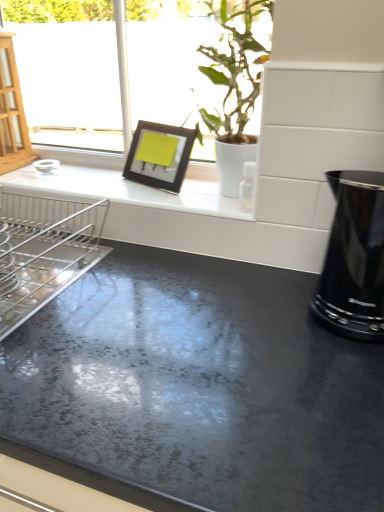
In order to face black matte picture frame at upper center, should I rotate leftwards or rightwards?

Rotate left and turn 4.777 degrees.

In order to face black glossy kettle at right, should I rotate leftwards or rightwards?

To align with it, rotate right about 20.689°.

Measure the distance between point (11, 252) and camera.

Point (11, 252) and camera are 33.43 inches apart.

What do you see at coordinates (124, 190) in the screenshot? I see `white glossy countertop at upper center` at bounding box center [124, 190].

The width and height of the screenshot is (384, 512). What are the coordinates of `black matte picture frame at upper center` in the screenshot? It's located at (159, 155).

Does green leafy plant at upper center have a larger size compared to black glossy kettle at right?

Indeed, green leafy plant at upper center has a larger size compared to black glossy kettle at right.

Would you say green leafy plant at upper center is a long distance from black glossy kettle at right?

That's not correct — green leafy plant at upper center is a little close to black glossy kettle at right.

How different are the orientations of green leafy plant at upper center and black glossy kettle at right in degrees?

green leafy plant at upper center and black glossy kettle at right are facing 6.84 degrees away from each other.

Would you say green leafy plant at upper center is inside or outside black glossy kettle at right?

green leafy plant at upper center cannot be found inside black glossy kettle at right.

Are black matte picture frame at upper center and black glossy kettle at right far apart?

No, there isn't a large distance between black matte picture frame at upper center and black glossy kettle at right.

From a real-world perspective, relative to black glossy kettle at right, is black matte picture frame at upper center vertically above or below?

Answer: black matte picture frame at upper center is situated higher than black glossy kettle at right in the real world.

Based on the photo, from the image's perspective, would you say black matte picture frame at upper center is positioned over black glossy kettle at right?

Yes.

Which object is closer to the camera taking this photo, black matte picture frame at upper center or black glossy kettle at right?

black glossy kettle at right is more forward.

Does black glossy kettle at right lie behind white glossy countertop at upper center?

That is False.

Considering the sizes of objects black glossy kettle at right and white glossy countertop at upper center in the image provided, who is smaller, black glossy kettle at right or white glossy countertop at upper center?

white glossy countertop at upper center is smaller.

Measure the distance between black glossy kettle at right and white glossy countertop at upper center.

A distance of 16.49 inches exists between black glossy kettle at right and white glossy countertop at upper center.

Is black glossy kettle at right inside the boundaries of white glossy countertop at upper center, or outside?

black glossy kettle at right is not enclosed by white glossy countertop at upper center.

Which object is positioned more to the right, white glossy countertop at upper center or silver metallic dish rack at left?

white glossy countertop at upper center is more to the right.

From the image's perspective, which object appears higher, white glossy countertop at upper center or silver metallic dish rack at left?

white glossy countertop at upper center, from the image's perspective.

Considering the positions of point (70, 170) and point (7, 256), is point (70, 170) closer or farther from the camera than point (7, 256)?

Clearly, point (70, 170) is more distant from the camera than point (7, 256).

How different are the orientations of white glossy countertop at upper center and silver metallic dish rack at left in degrees?

The angular difference between white glossy countertop at upper center and silver metallic dish rack at left is 0.37 degrees.

Would you say black glossy kettle at right contains silver metallic dish rack at left?

No, silver metallic dish rack at left is not surrounded by black glossy kettle at right.

Does black glossy kettle at right have a lesser width compared to silver metallic dish rack at left?

Indeed, black glossy kettle at right has a lesser width compared to silver metallic dish rack at left.

From a real-world perspective, is black glossy kettle at right located higher than silver metallic dish rack at left?

Correct, in the physical world, black glossy kettle at right is higher than silver metallic dish rack at left.

Which is more distant, [351,243] or [91,246]?

The point [91,246] is farther.

Between point (159, 144) and point (156, 203), which one is positioned behind?

The point (159, 144) is farther from the camera.

Which object is positioned more to the left, black matte picture frame at upper center or white glossy countertop at upper center?

white glossy countertop at upper center is more to the left.

Is black matte picture frame at upper center closer to the viewer compared to white glossy countertop at upper center?

No, it is not.

Is black matte picture frame at upper center turned away from white glossy countertop at upper center?

black matte picture frame at upper center does not have its back to white glossy countertop at upper center.

Is white glossy countertop at upper center smaller than green leafy plant at upper center?

Indeed, white glossy countertop at upper center has a smaller size compared to green leafy plant at upper center.

In the image, is white glossy countertop at upper center on the left side or the right side of green leafy plant at upper center?

white glossy countertop at upper center is positioned on green leafy plant at upper center's left side.

Is white glossy countertop at upper center with green leafy plant at upper center?

No, white glossy countertop at upper center is not in contact with green leafy plant at upper center.

Is white glossy countertop at upper center positioned with its back to green leafy plant at upper center?

No, green leafy plant at upper center is not at the back of white glossy countertop at upper center.

Where is `houseplant that appears above the black glossy kettle at right (from a real-world perspective)`? houseplant that appears above the black glossy kettle at right (from a real-world perspective) is located at coordinates (234, 88).

The image size is (384, 512). Identify the location of appliance below the black matte picture frame at upper center (from the image's perspective). (354, 258).

Which object lies nearer to the anchor point black glossy kettle at right, green leafy plant at upper center or silver metallic dish rack at left?

green leafy plant at upper center lies closer to black glossy kettle at right than the other object.

From the image, which object appears to be nearer to black matte picture frame at upper center, green leafy plant at upper center or black glossy kettle at right?

green leafy plant at upper center lies closer to black matte picture frame at upper center than the other object.

When comparing their distances from white glossy countertop at upper center, does green leafy plant at upper center or black glossy kettle at right seem further?

Among the two, black glossy kettle at right is located further to white glossy countertop at upper center.

When comparing their distances from black matte picture frame at upper center, does silver metallic dish rack at left or black glossy kettle at right seem closer?

silver metallic dish rack at left.

From the image, which object appears to be farther from silver metallic dish rack at left, green leafy plant at upper center or black glossy kettle at right?

black glossy kettle at right.

In the scene shown: Which object lies further to the anchor point black glossy kettle at right, white glossy countertop at upper center or green leafy plant at upper center?

white glossy countertop at upper center lies further to black glossy kettle at right than the other object.

Looking at the image, which one is located closer to green leafy plant at upper center, black matte picture frame at upper center or white glossy countertop at upper center?

The object closer to green leafy plant at upper center is black matte picture frame at upper center.

Based on the photo, considering their positions, is black matte picture frame at upper center positioned further to black glossy kettle at right than white glossy countertop at upper center?

Based on the image, black matte picture frame at upper center appears to be further to black glossy kettle at right.

Where is `picture frame situated between white glossy countertop at upper center and black glossy kettle at right from left to right`? The image size is (384, 512). picture frame situated between white glossy countertop at upper center and black glossy kettle at right from left to right is located at coordinates (159, 155).

Identify the location of houseplant located between black glossy kettle at right and black matte picture frame at upper center in the depth direction. The width and height of the screenshot is (384, 512). (234, 88).

Identify the location of counter top between silver metallic dish rack at left and black matte picture frame at upper center from front to back. (124, 190).

I want to click on counter top between silver metallic dish rack at left and green leafy plant at upper center in the horizontal direction, so click(x=124, y=190).